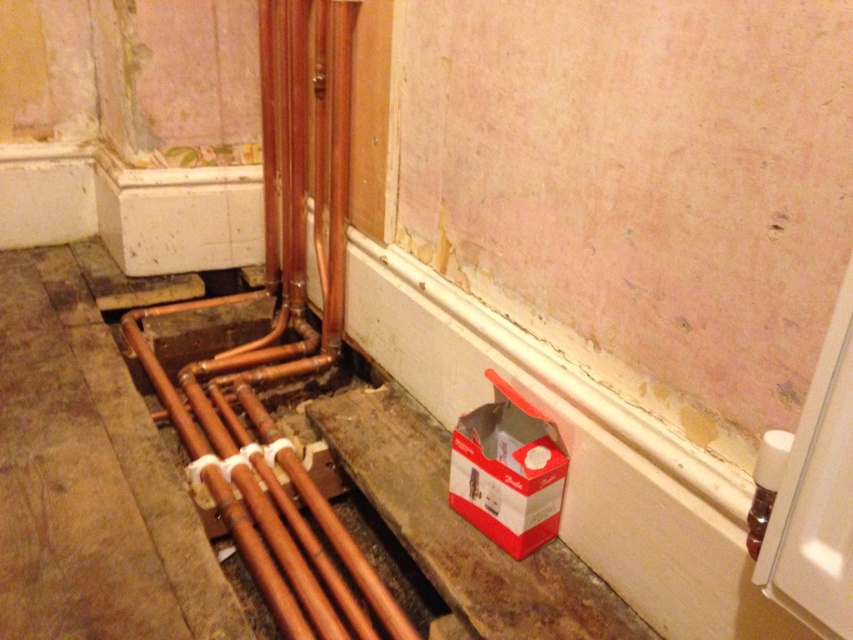
Question: Which object is farther from the camera taking this photo?

Choices:
 (A) copper pipes at lower left
 (B) red cardboard box at lower right

Answer: (A)

Question: Can you confirm if copper pipes at lower left is positioned below red cardboard box at lower right?

Choices:
 (A) no
 (B) yes

Answer: (B)

Question: Can you confirm if copper pipes at lower left is positioned below red cardboard box at lower right?

Choices:
 (A) yes
 (B) no

Answer: (A)

Question: Does copper pipes at lower left have a greater width compared to red cardboard box at lower right?

Choices:
 (A) yes
 (B) no

Answer: (A)